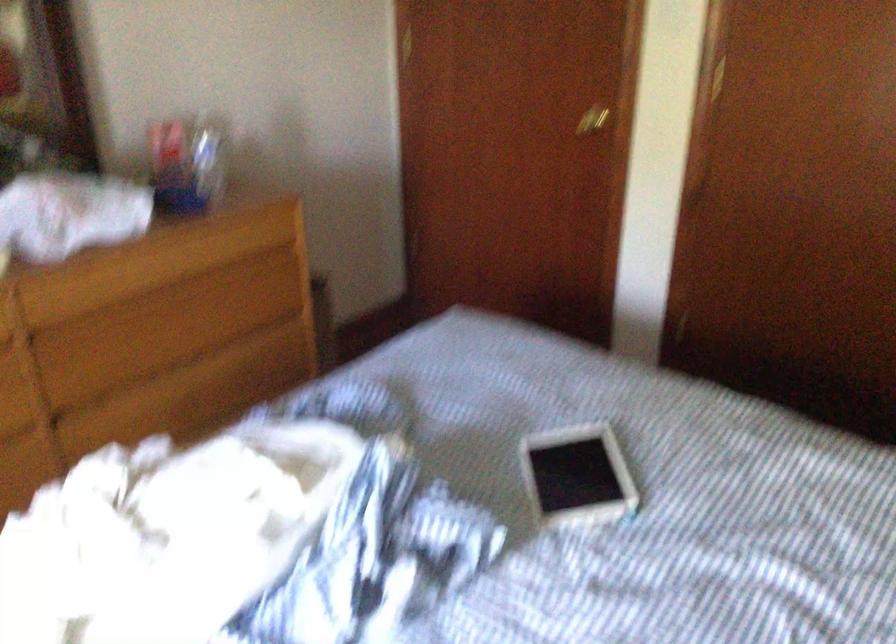
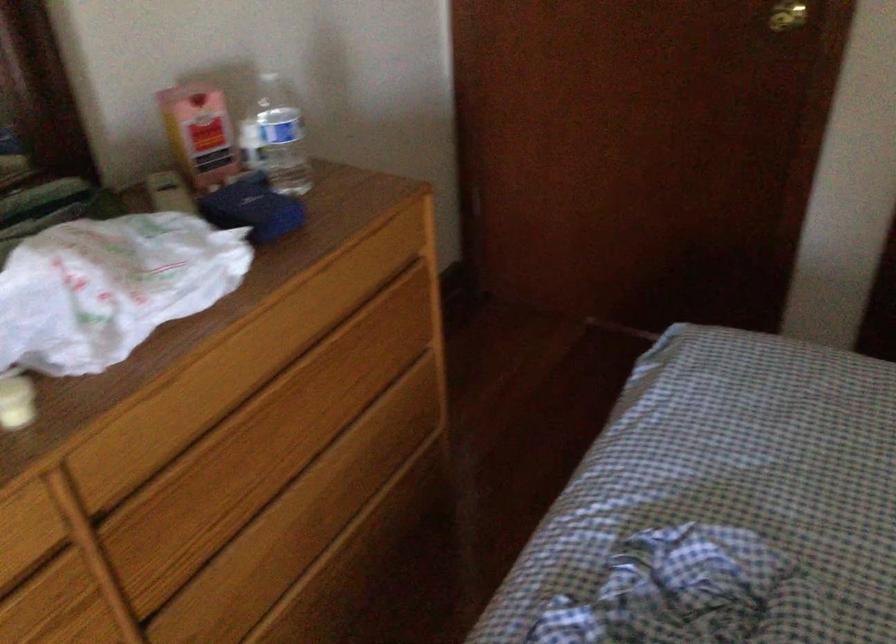
The point at (149,339) is marked in the first image. Where is the corresponding point in the second image?

(263, 456)